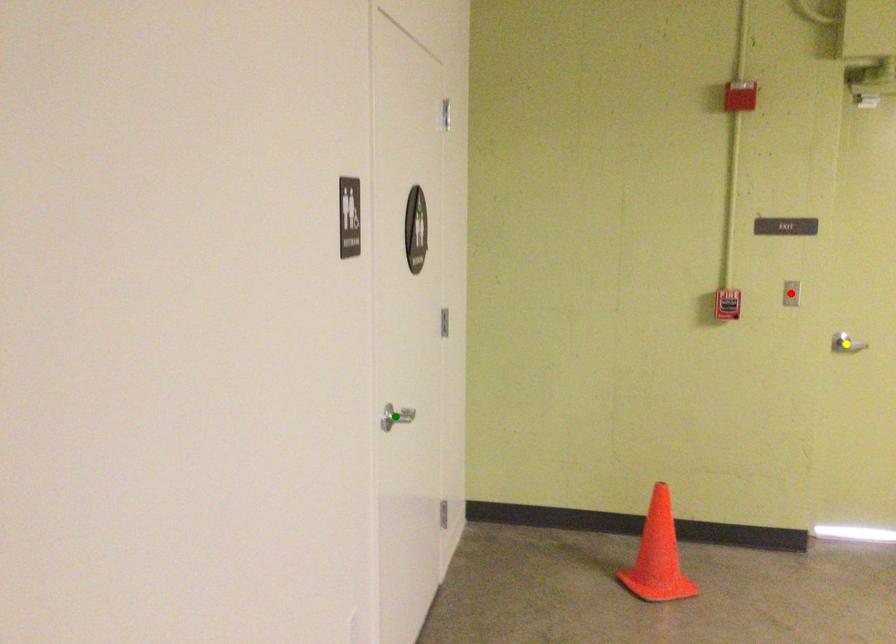
Based on the photo, order these from farthest to nearest:
- yellow point
- green point
- red point

yellow point, red point, green point